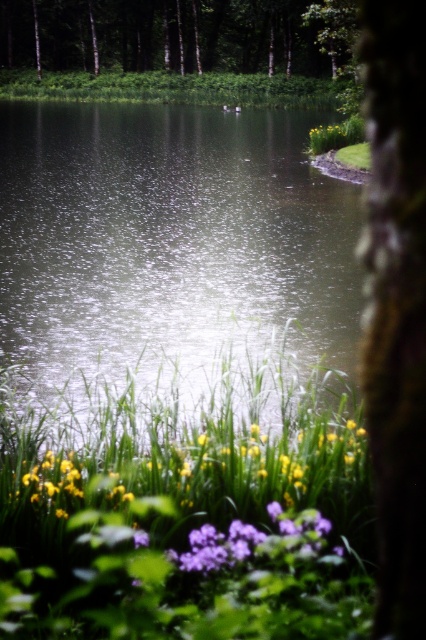
Can you confirm if yellow matte flower at upper right is shorter than green grass at upper right?

No.

Is yellow matte flower at upper right to the left of green grass at upper right from the viewer's perspective?

In fact, yellow matte flower at upper right is to the right of green grass at upper right.

Identify the location of yellow matte flower at upper right. (328, 136).

Identify the location of yellow matte flower at upper right. (328, 136).

Does smooth bark tree trunk at right appear under yellow matte flower at upper right?

Yes.

Where is `smooth bark tree trunk at right`? smooth bark tree trunk at right is located at coordinates (397, 304).

Does point (405, 401) come in front of point (327, 150)?

Yes, point (405, 401) is in front of point (327, 150).

Where is `smooth bark tree trunk at right`? The height and width of the screenshot is (640, 426). smooth bark tree trunk at right is located at coordinates (397, 304).

Does smooth bark tree at upper center have a greater width compared to green matte tree at upper center?

Yes, smooth bark tree at upper center is wider than green matte tree at upper center.

Between point (192, 67) and point (325, 38), which one is positioned behind?

Positioned behind is point (192, 67).

In order to click on smooth bark tree at upper center in this screenshot , I will do coord(181,35).